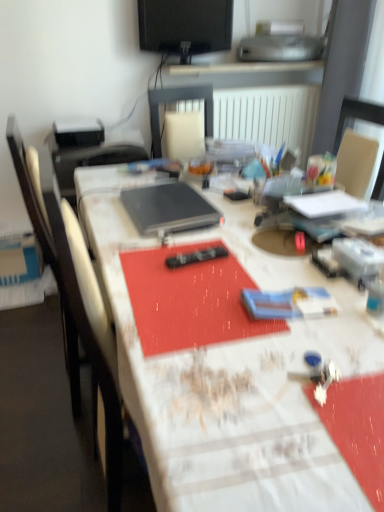
Find the location of a particular element. This screenshot has width=384, height=512. vacant area that lies between black matte laptop at center and black plastic remote control at center is located at coordinates coord(191,242).